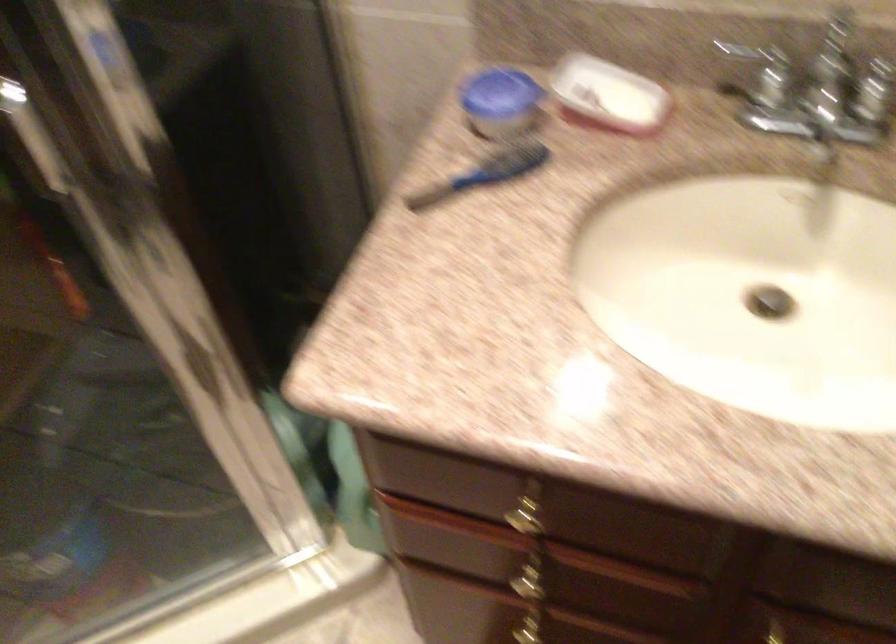
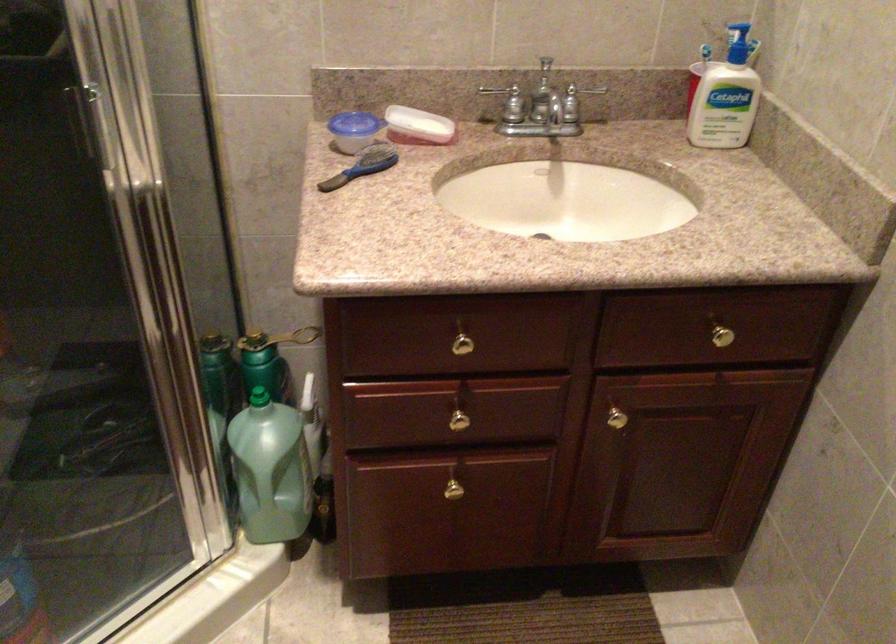
Where in the second image is the point corresponding to (x=536, y=569) from the first image?

(459, 415)